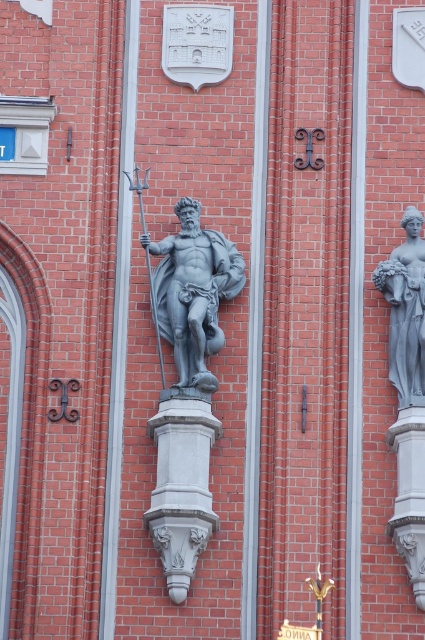
You are an art student standing in front of the building facade. You notice the gray stone pedestal at center and the gold metallic plaque at center bottom. Which object is closer to you?

The gray stone pedestal at center is closer to you because the gold metallic plaque at center bottom is behind it.